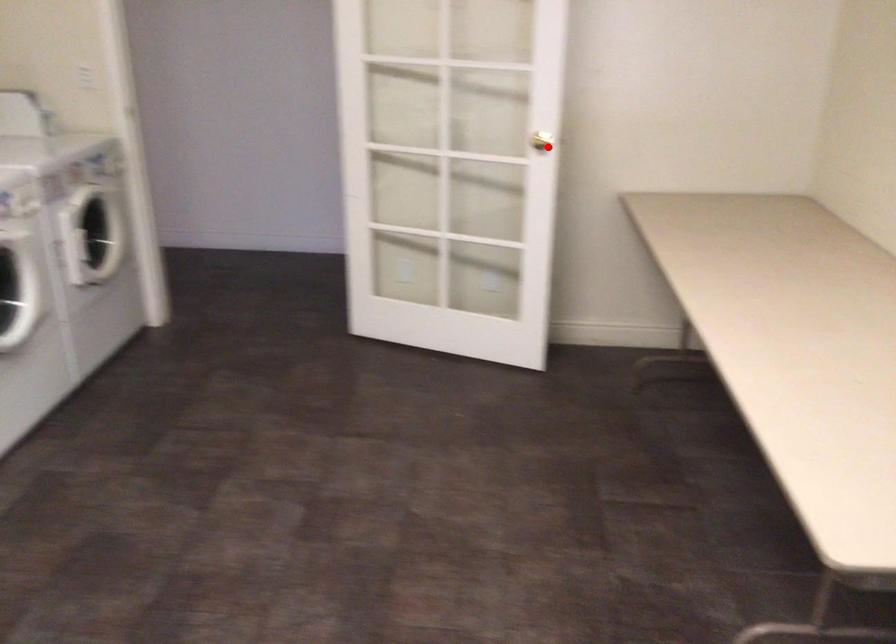
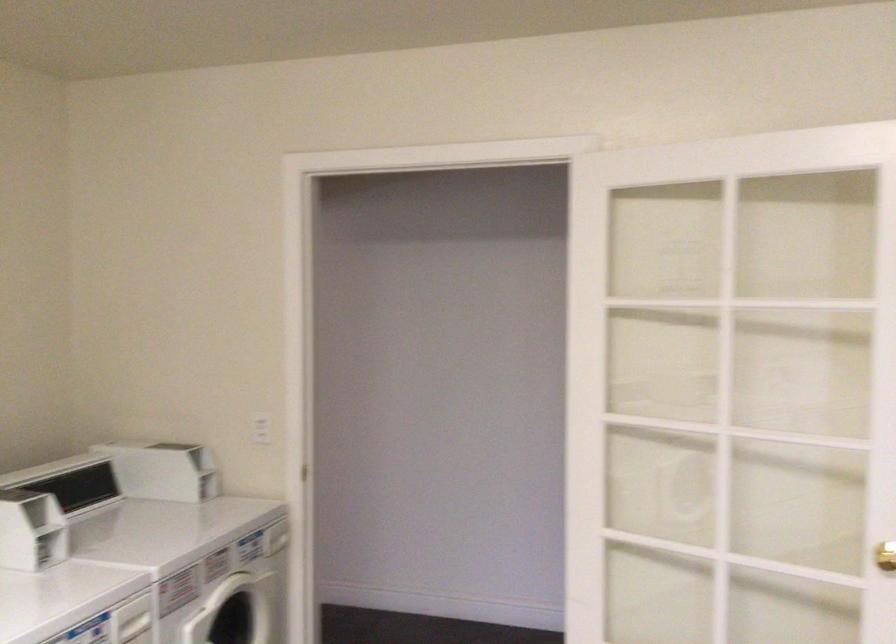
Question: A red point is marked in image1. In image2, is the corresponding 3D point closer to the camera or farther? Reply with the corresponding letter.

Choices:
 (A) The corresponding 3D point is closer.
 (B) The corresponding 3D point is farther.

Answer: (A)